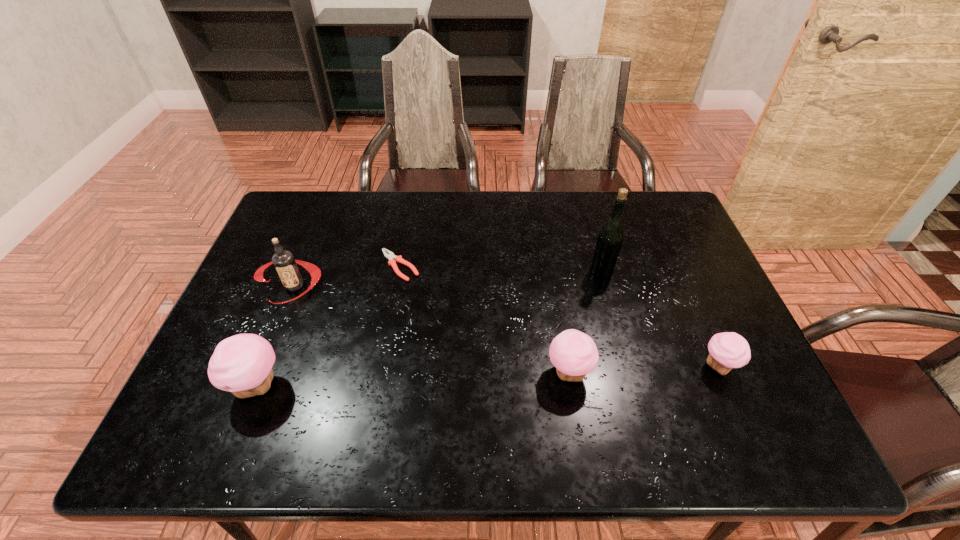
Find the location of a particular element. The width and height of the screenshot is (960, 540). the tallest cupcake is located at coordinates (242, 364).

The height and width of the screenshot is (540, 960). Find the location of `the fourth tallest object`. the fourth tallest object is located at coordinates (574, 354).

Where is `the second cupcake from right to left`? The height and width of the screenshot is (540, 960). the second cupcake from right to left is located at coordinates click(574, 354).

Find the location of a particular element. The width and height of the screenshot is (960, 540). the rightmost object is located at coordinates (728, 350).

Locate an element on the screen. the rightmost cupcake is located at coordinates (728, 350).

Locate an element on the screen. The image size is (960, 540). pliers is located at coordinates (390, 255).

Locate an element on the screen. This screenshot has width=960, height=540. the third object from left to right is located at coordinates (390, 255).

Where is `root beer`? root beer is located at coordinates (285, 264).

The image size is (960, 540). What are the coordinates of `beer bottle` in the screenshot? It's located at (610, 238).

Image resolution: width=960 pixels, height=540 pixels. In order to click on the tallest object in this screenshot , I will do `click(610, 238)`.